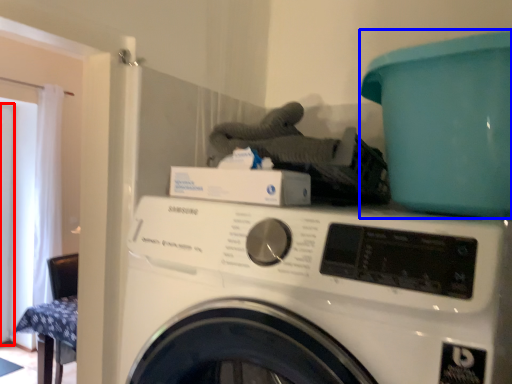
Question: Which object appears farthest to the camera in this image, screen door (highlighted by a red box) or teal (highlighted by a blue box)?

Choices:
 (A) screen door
 (B) teal

Answer: (A)